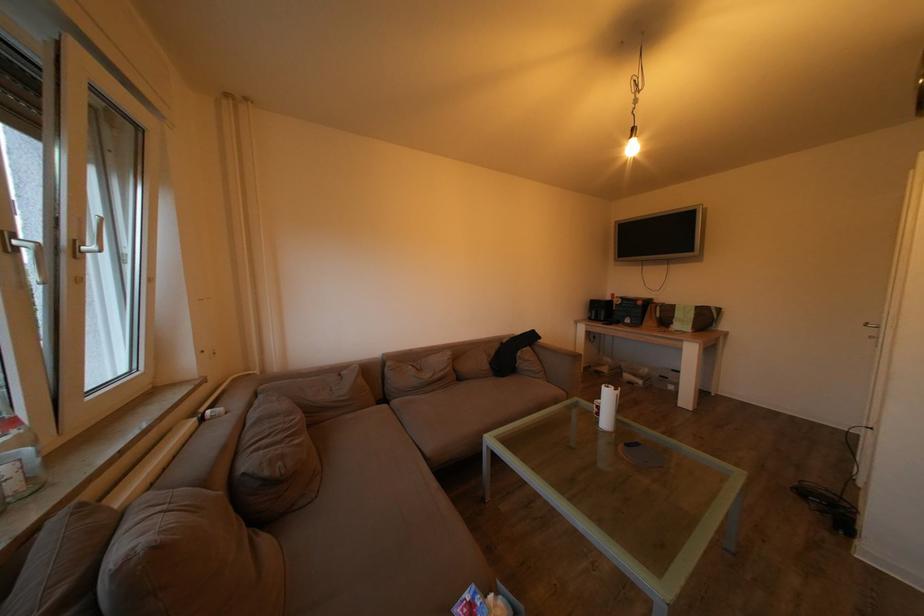
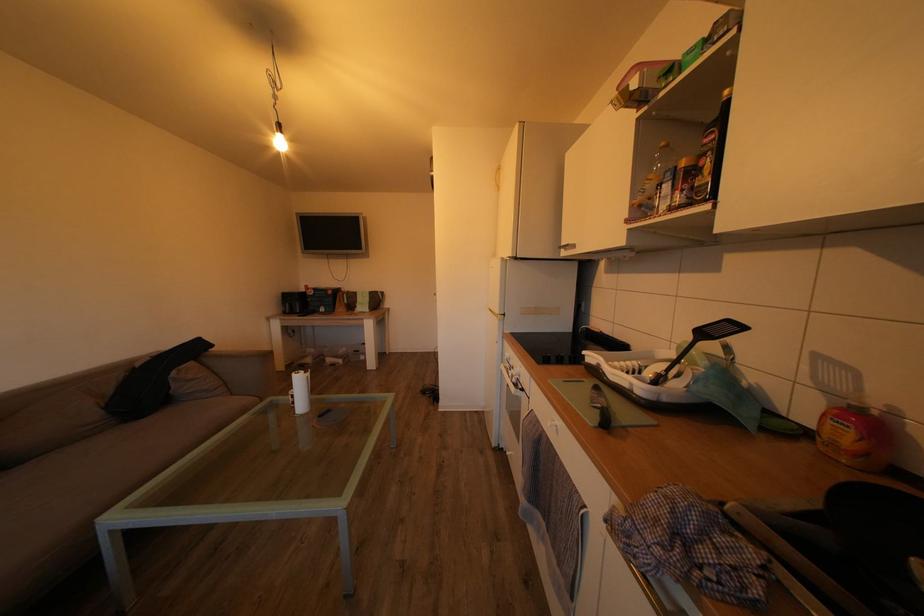
Question: The first image is from the beginning of the video and the second image is from the end. How did the camera likely rotate when shooting the video?

Choices:
 (A) Left
 (B) Right
 (C) Up
 (D) Down

Answer: (B)